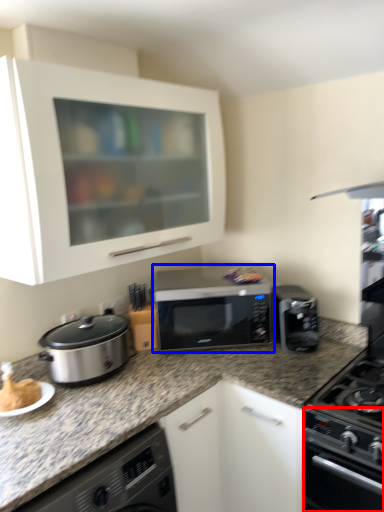
Question: Among these objects, which one is nearest to the camera, oven (highlighted by a red box) or microwave oven (highlighted by a blue box)?

Choices:
 (A) oven
 (B) microwave oven

Answer: (A)